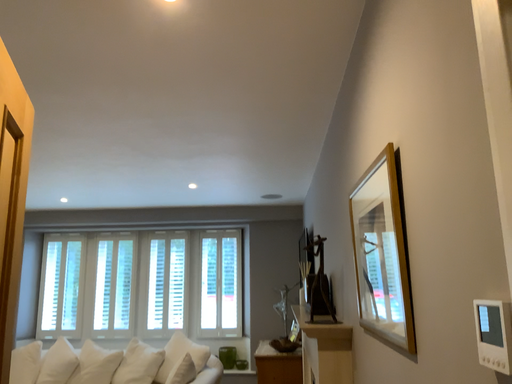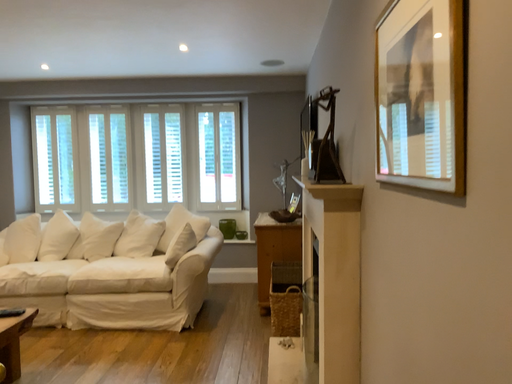
Question: Which way did the camera rotate in the video?

Choices:
 (A) rotated upward
 (B) rotated downward

Answer: (B)